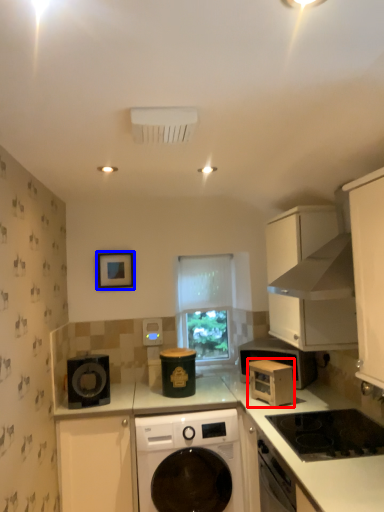
Question: Which of the following is the farthest to the observer, microwave oven (highlighted by a red box) or picture frame (highlighted by a blue box)?

Choices:
 (A) microwave oven
 (B) picture frame

Answer: (B)